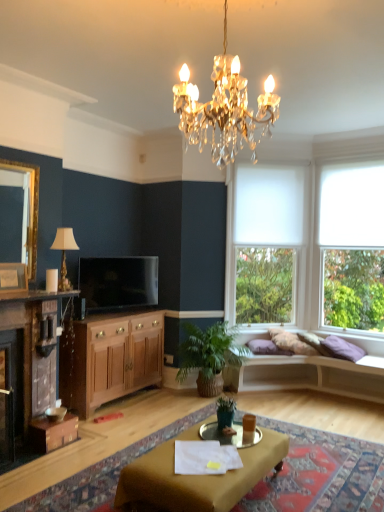
Locate an element on the screen. vacant area that is in front of green matte plant at center, the first houseplant positioned from the front is located at coordinates (227, 436).